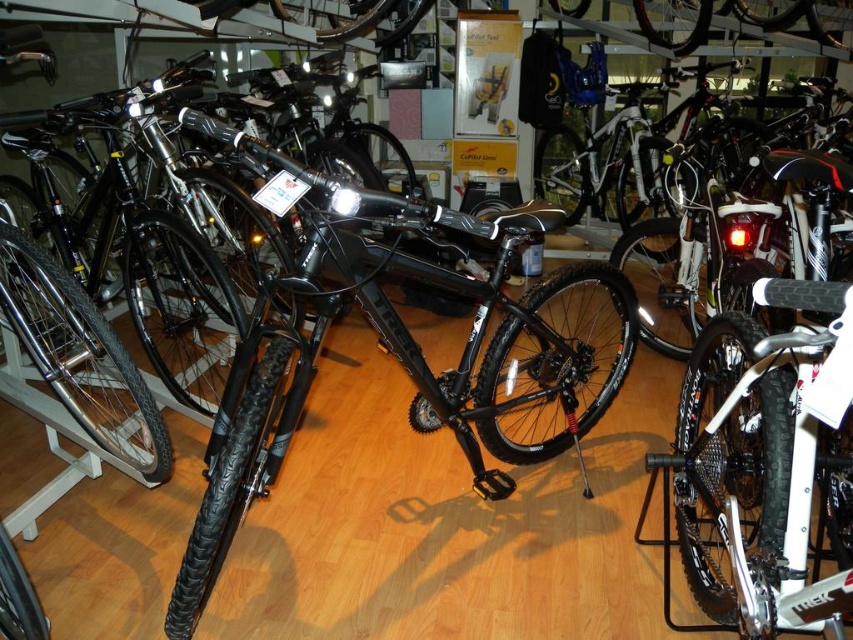
Question: Is black matte bicycle at center above white matte bicycle at center?

Choices:
 (A) no
 (B) yes

Answer: (B)

Question: Which point is farther from the camera taking this photo?

Choices:
 (A) (193, 532)
 (B) (732, 556)

Answer: (A)

Question: Which object is closer to the camera taking this photo?

Choices:
 (A) black matte bicycle at center
 (B) white matte bicycle at center

Answer: (B)

Question: Does black matte bicycle at center have a greater width compared to white matte bicycle at center?

Choices:
 (A) yes
 (B) no

Answer: (A)

Question: Can you confirm if black matte bicycle at center is bigger than white matte bicycle at center?

Choices:
 (A) yes
 (B) no

Answer: (A)

Question: Among these points, which one is farthest from the camera?

Choices:
 (A) (270, 332)
 (B) (764, 445)

Answer: (A)